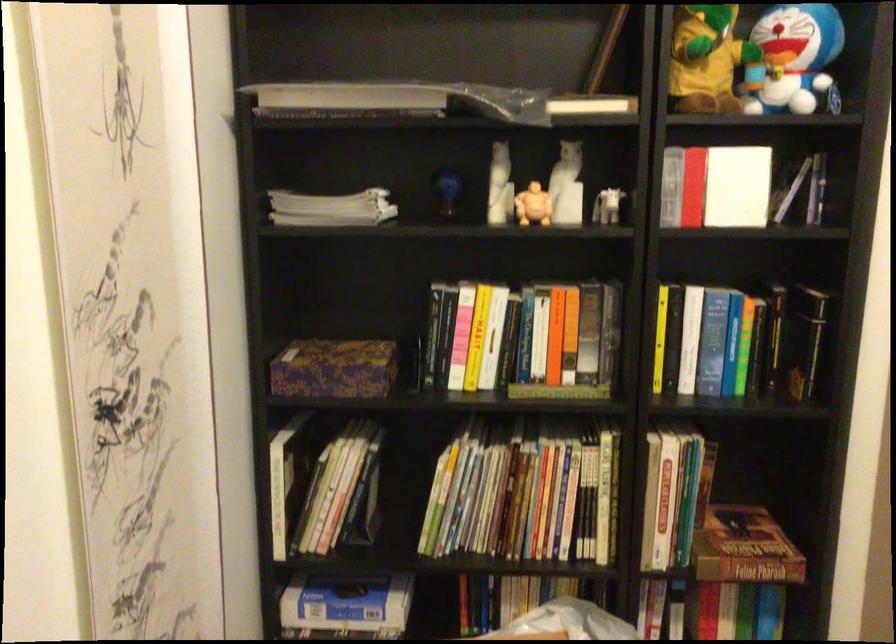
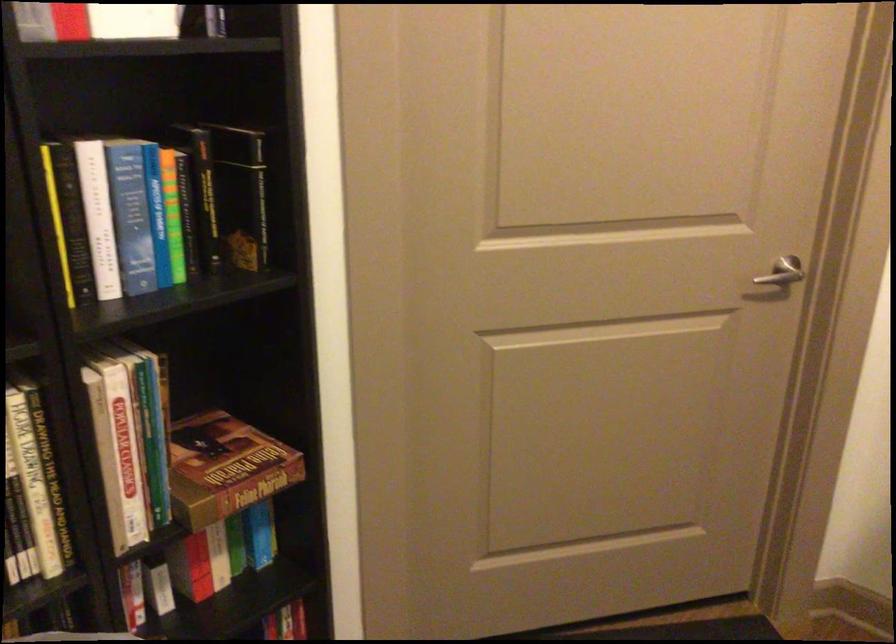
Where in the second image is the point corresponding to (736,337) from the first image?

(156, 214)